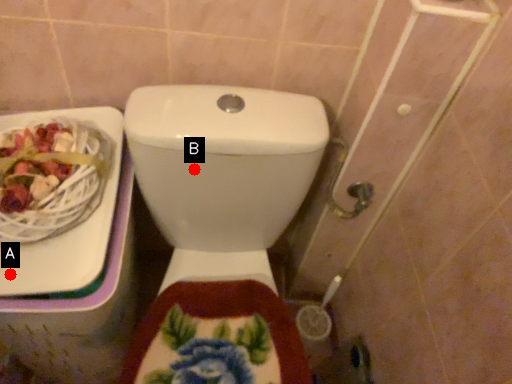
Question: Two points are circled on the image, labeled by A and B beside each circle. Which of the following is the farthest from the observer?

Choices:
 (A) A is further
 (B) B is further

Answer: (B)